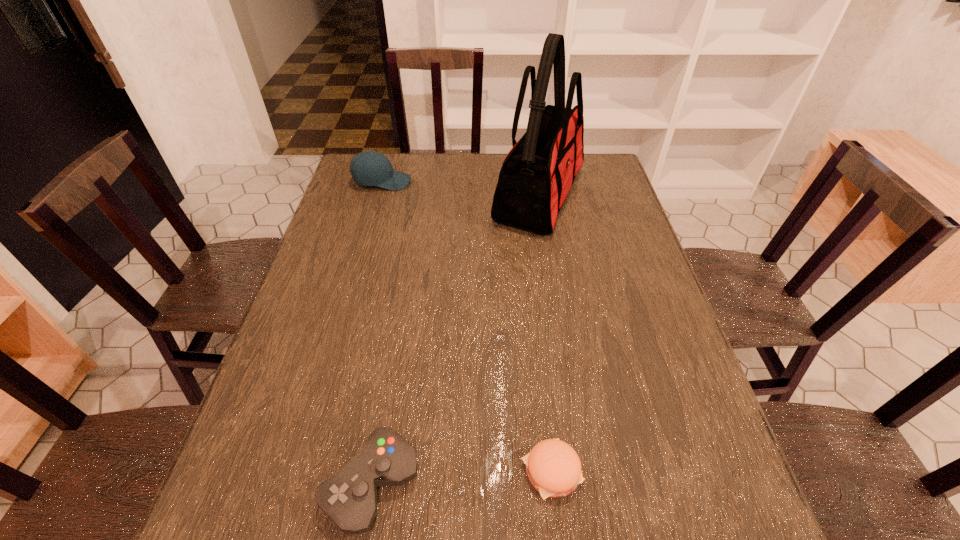
Where is `object that is the third closest to the control`? object that is the third closest to the control is located at coordinates (369, 168).

Identify the location of object that is the second closest to the second shortest object. (537, 173).

At what (x,y) coordinates should I click in order to perform the action: click on vacant region that satisfies the following two spatial constraints: 1. on the back side of the shortest object; 2. on the front-facing side of the baseball cap. Please return your answer as a coordinate pair (x, y). Looking at the image, I should click on (519, 182).

Where is `vacant space that satisfies the following two spatial constraints: 1. on the front-facing side of the baseball cap; 2. on the right side of the shortest object`? The width and height of the screenshot is (960, 540). vacant space that satisfies the following two spatial constraints: 1. on the front-facing side of the baseball cap; 2. on the right side of the shortest object is located at coordinates (300, 471).

Where is `free spot that satisfies the following two spatial constraints: 1. on the front-facing side of the shortest object; 2. on the right side of the second tallest object`? The image size is (960, 540). free spot that satisfies the following two spatial constraints: 1. on the front-facing side of the shortest object; 2. on the right side of the second tallest object is located at coordinates (300, 471).

Locate an element on the screen. This screenshot has width=960, height=540. vacant position in the image that satisfies the following two spatial constraints: 1. on the front-facing side of the second tallest object; 2. on the right side of the duffel bag is located at coordinates (378, 196).

This screenshot has height=540, width=960. What are the coordinates of `free space in the image that satisfies the following two spatial constraints: 1. on the front-facing side of the duffel bag; 2. on the left side of the second tallest object` in the screenshot? It's located at (378, 196).

You are a GUI agent. You are given a task and a screenshot of the screen. Output one action in this format:
    pyautogui.click(x=<x>, y=<y>)
    Task: Click on the vacant space that satisfies the following two spatial constraints: 1. on the front-facing side of the second tallest object; 2. on the back side of the duffel bag
    The image size is (960, 540).
    Given the screenshot: What is the action you would take?
    pyautogui.click(x=378, y=196)